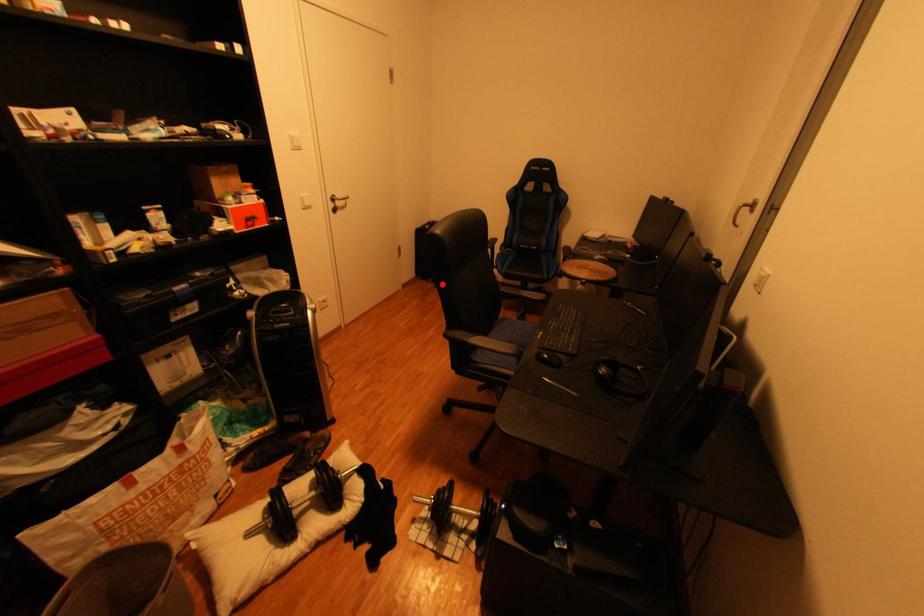
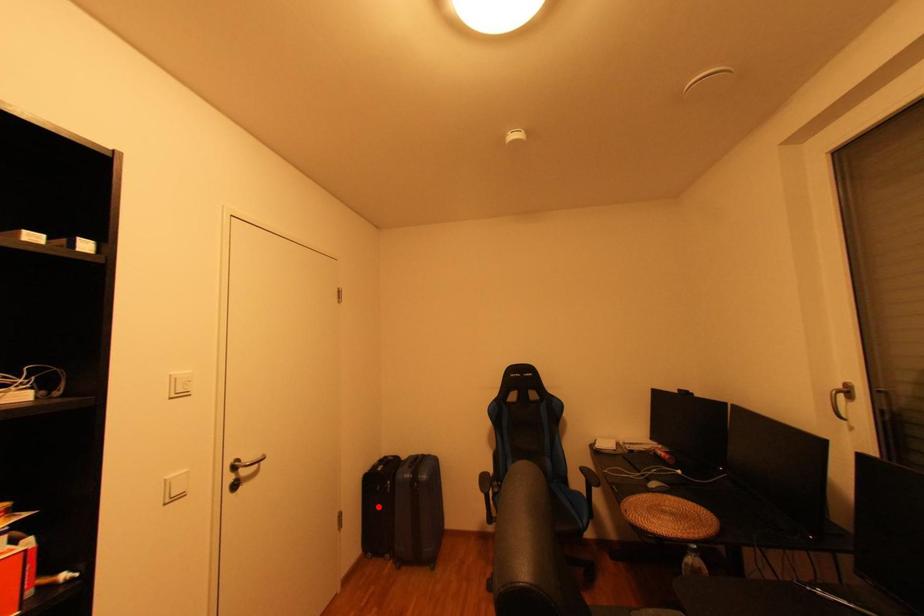
I am providing you with two images of the same scene from different viewpoints. A red point is marked on the first image and another point is marked on the second image. Does the point marked in image1 correspond to the same location as the one in image2?

No